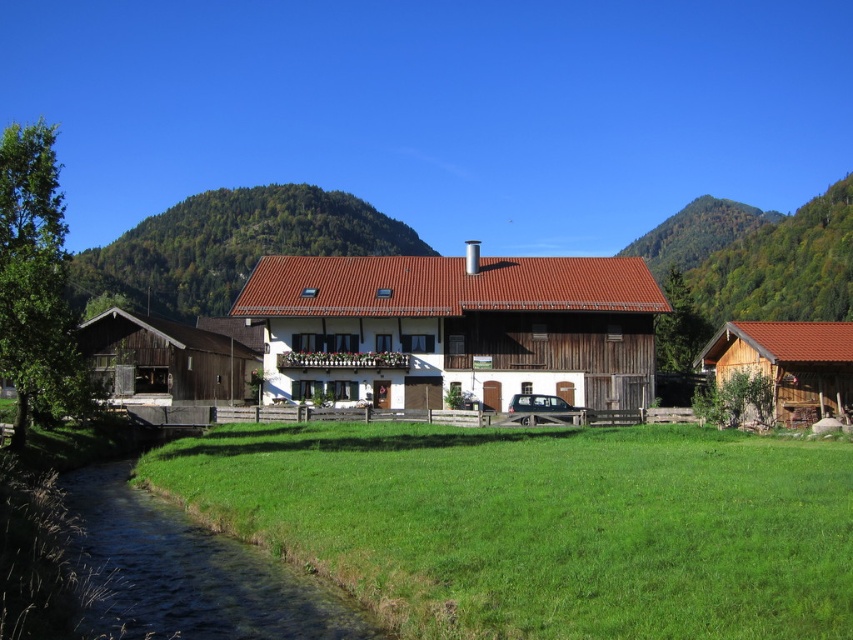
Question: Which point is closer to the camera?

Choices:
 (A) (187, 576)
 (B) (772, 403)

Answer: (A)

Question: Considering the relative positions of green grass at lower left and brown wooden hut at lower right in the image provided, where is green grass at lower left located with respect to brown wooden hut at lower right?

Choices:
 (A) below
 (B) above

Answer: (A)

Question: Which object appears farthest from the camera in this image?

Choices:
 (A) green grassy hillside at upper center
 (B) green grass at lower left

Answer: (A)

Question: Considering the real-world distances, which object is closest to the green grassy hillside at upper center?

Choices:
 (A) white wooden house at center
 (B) brown wooden hut at lower right
 (C) clear water at lower left

Answer: (A)

Question: Considering the relative positions of green grass at lower left and brown wooden hut at left in the image provided, where is green grass at lower left located with respect to brown wooden hut at left?

Choices:
 (A) right
 (B) left

Answer: (A)

Question: Does green grassy hillside at upper center appear over brown wooden hut at lower right?

Choices:
 (A) yes
 (B) no

Answer: (A)